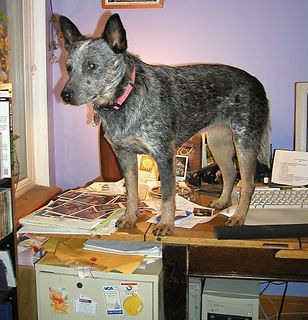
The height and width of the screenshot is (320, 308). I want to click on keyboard, so click(280, 201).